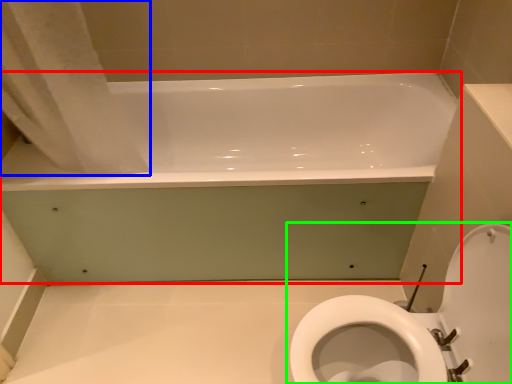
Question: Considering the real-world distances, which object is farthest from bathtub (highlighted by a red box)? shower curtain (highlighted by a blue box) or toilet (highlighted by a green box)?

Choices:
 (A) shower curtain
 (B) toilet

Answer: (B)